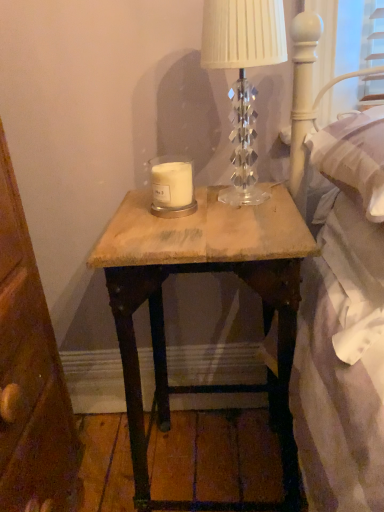
I want to click on free space in front of clear crystal lamp at upper center, so click(242, 227).